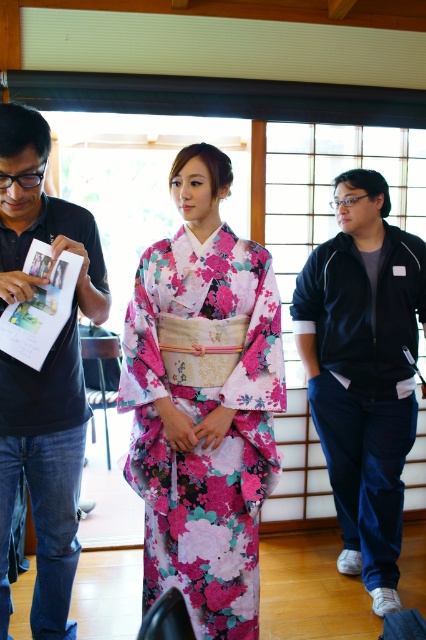
Can you confirm if dark blue zip-up jacket at right is bigger than matte black shirt at left?

Correct, dark blue zip-up jacket at right is larger in size than matte black shirt at left.

Which is behind, point (385, 452) or point (74, 317)?

The point (385, 452) is more distant.

What do you see at coordinates (363, 371) in the screenshot? The image size is (426, 640). I see `dark blue zip-up jacket at right` at bounding box center [363, 371].

At what (x,y) coordinates should I click in order to perform the action: click on dark blue zip-up jacket at right. Please return your answer as a coordinate pair (x, y). The height and width of the screenshot is (640, 426). Looking at the image, I should click on (363, 371).

Can you confirm if floral silk kimono at center is positioned to the right of matte black shirt at left?

Yes, floral silk kimono at center is to the right of matte black shirt at left.

Who is positioned more to the left, floral silk kimono at center or matte black shirt at left?

matte black shirt at left is more to the left.

Find the location of a particular element. floral silk kimono at center is located at coordinates (198, 422).

In the scene shown: Does floral silk kimono at center appear on the right side of dark blue zip-up jacket at right?

No, floral silk kimono at center is not to the right of dark blue zip-up jacket at right.

Can you confirm if floral silk kimono at center is shorter than dark blue zip-up jacket at right?

Yes, floral silk kimono at center is shorter than dark blue zip-up jacket at right.

Between point (146, 257) and point (342, 420), which one is positioned in front?

Point (146, 257) is more forward.

This screenshot has width=426, height=640. Find the location of `floral silk kimono at center`. floral silk kimono at center is located at coordinates (198, 422).